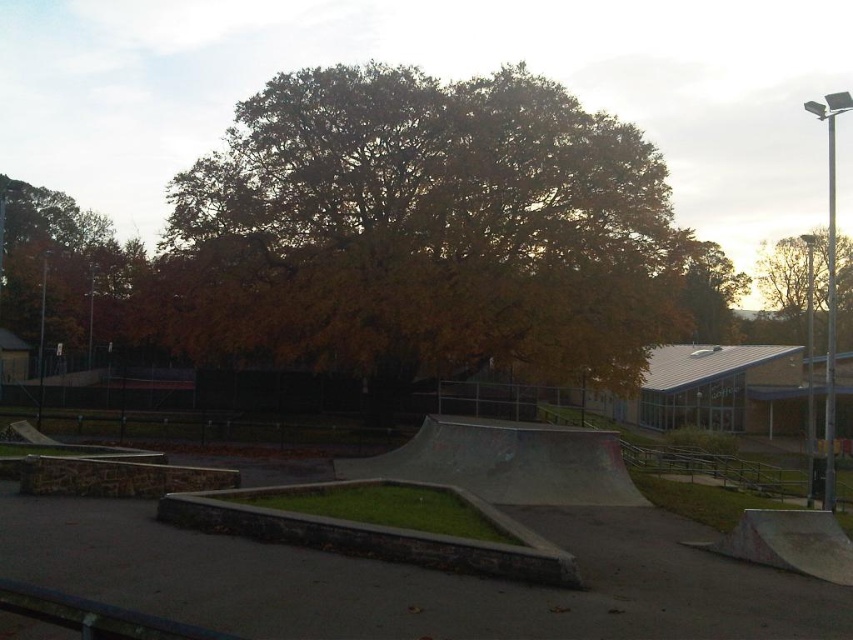
Between point (39, 236) and point (850, 326), which one is positioned in front?

Point (39, 236)

Is autumn leaves at left positioned at the back of brown leafy tree at upper right?

No, autumn leaves at left is closer to the viewer.

At what (x,y) coordinates should I click in order to perform the action: click on autumn leaves at left. Please return your answer as a coordinate pair (x, y). Image resolution: width=853 pixels, height=640 pixels. Looking at the image, I should click on (61, 268).

Locate an element on the screen. The image size is (853, 640). autumn leaves at left is located at coordinates (61, 268).

Can you confirm if yellow-green leaves at center is positioned to the right of brown leafy tree at upper right?

Incorrect, yellow-green leaves at center is not on the right side of brown leafy tree at upper right.

Is yellow-green leaves at center taller than brown leafy tree at upper right?

No, yellow-green leaves at center is not taller than brown leafy tree at upper right.

Who is more forward, [300,122] or [778,252]?

Positioned in front is point [300,122].

Where is `yellow-green leaves at center`? yellow-green leaves at center is located at coordinates (422, 230).

Is autumn leaves at left above yellow leafy tree at upper center?

Indeed, autumn leaves at left is positioned over yellow leafy tree at upper center.

Measure the distance from autumn leaves at left to yellow leafy tree at upper center.

59.91 meters

Which is behind, point (42, 268) or point (730, 301)?

Positioned behind is point (730, 301).

This screenshot has width=853, height=640. In order to click on autumn leaves at left in this screenshot , I will do `click(61, 268)`.